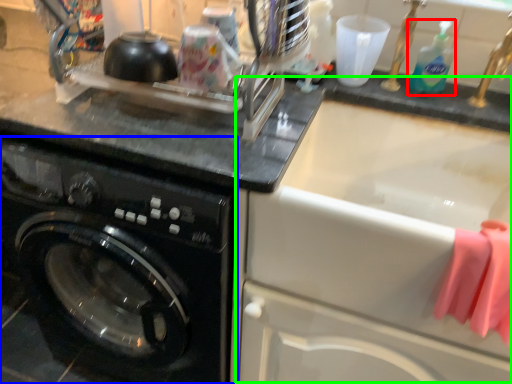
Question: Which object is positioned closest to cleaning product (highlighted by a red box)? Select from washing machine (highlighted by a blue box) and sink (highlighted by a green box).

Choices:
 (A) washing machine
 (B) sink

Answer: (B)